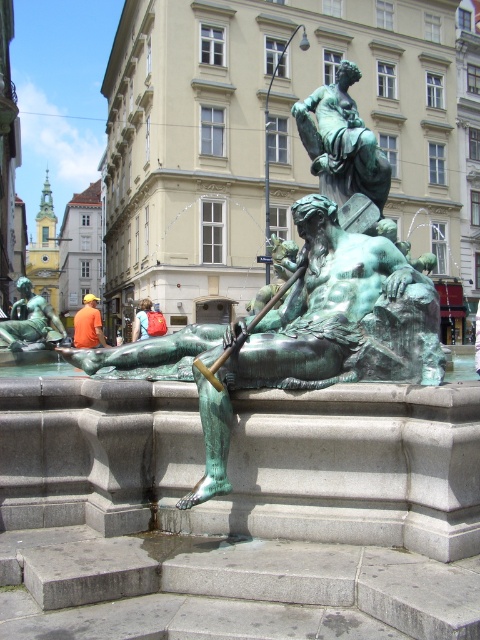
How distant is green patina bronze statue at center from orange fabric shirt at center?

green patina bronze statue at center and orange fabric shirt at center are 26.91 meters apart.

What do you see at coordinates (300, 333) in the screenshot? This screenshot has height=640, width=480. I see `green patina bronze statue at center` at bounding box center [300, 333].

Where is `green patina bronze statue at center`? green patina bronze statue at center is located at coordinates pyautogui.click(x=300, y=333).

Which is behind, point (332, 145) or point (54, 323)?

Positioned behind is point (54, 323).

Can you confirm if green patina statue at upper center is positioned above green patina statue at lower left?

Yes.

Identify the location of green patina statue at upper center. [x=342, y=141].

Can you confirm if green patina statue at upper center is shorter than orange fabric shirt at center?

No, green patina statue at upper center is not shorter than orange fabric shirt at center.

Does green patina statue at upper center appear under orange fabric shirt at center?

Incorrect, green patina statue at upper center is not positioned below orange fabric shirt at center.

At what (x,y) coordinates should I click in order to perform the action: click on green patina statue at upper center. Please return your answer as a coordinate pair (x, y). This screenshot has height=640, width=480. Looking at the image, I should click on (342, 141).

Locate an element on the screen. The image size is (480, 640). green patina statue at upper center is located at coordinates (342, 141).